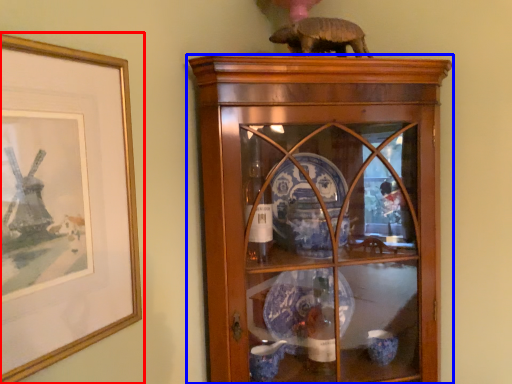
Question: Which object is closer to the camera taking this photo, picture frame (highlighted by a red box) or shelf (highlighted by a blue box)?

Choices:
 (A) picture frame
 (B) shelf

Answer: (A)